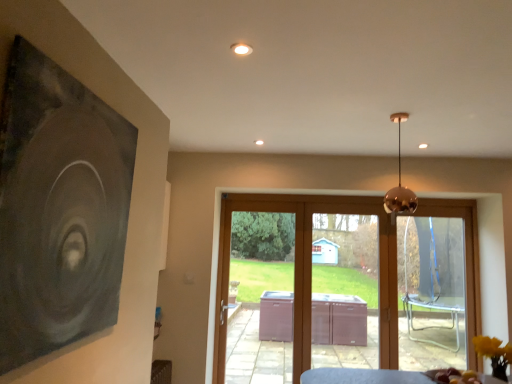
This screenshot has height=384, width=512. What are the coordinates of `brown wood screen door at center` in the screenshot? It's located at (345, 290).

What do you see at coordinates (400, 184) in the screenshot? I see `copper reflective pendant light at upper center` at bounding box center [400, 184].

Find the location of a particular element. The image size is (512, 384). brown wood screen door at center is located at coordinates (345, 290).

Looking at this image, measure the distance between brown wooden door at center and brown wood screen door at center.

brown wooden door at center is 1.36 inches away from brown wood screen door at center.

Considering the sizes of brown wooden door at center and brown wood screen door at center in the image, is brown wooden door at center wider or thinner than brown wood screen door at center?

brown wooden door at center is wider than brown wood screen door at center.

From the image's perspective, is brown wooden door at center positioned above or below brown wood screen door at center?

Clearly, from the image's perspective, brown wooden door at center is below brown wood screen door at center.

From the picture: From a real-world perspective, is brown wooden door at center positioned over brown wood screen door at center based on gravity?

No.

Locate an element on the screen. This screenshot has width=512, height=384. lamp on the right of dark matte painting at left is located at coordinates (400, 184).

From the picture: Is dark matte painting at left located outside copper reflective pendant light at upper center?

Absolutely, dark matte painting at left is external to copper reflective pendant light at upper center.

Is dark matte painting at left oriented towards copper reflective pendant light at upper center?

Yes, dark matte painting at left is oriented towards copper reflective pendant light at upper center.

Is brown wood screen door at center far from copper reflective pendant light at upper center?

brown wood screen door at center is positioned a significant distance from copper reflective pendant light at upper center.

How far apart are brown wood screen door at center and copper reflective pendant light at upper center?

7.27 feet.

Choose the correct answer: Is brown wood screen door at center inside copper reflective pendant light at upper center or outside it?

brown wood screen door at center exists outside the volume of copper reflective pendant light at upper center.

Does point (111, 117) lie behind point (305, 333)?

That is False.

From a real-world perspective, does dark matte painting at left stand above brown wooden door at center?

Correct, in the physical world, dark matte painting at left is higher than brown wooden door at center.

Is dark matte painting at left situated inside brown wooden door at center or outside?

dark matte painting at left is outside brown wooden door at center.

Is dark matte painting at left facing towards brown wooden door at center?

No, dark matte painting at left is not aimed at brown wooden door at center.

Does dark matte painting at left have a greater width compared to brown wood screen door at center?

Incorrect, the width of dark matte painting at left does not surpass that of brown wood screen door at center.

In terms of size, does dark matte painting at left appear bigger or smaller than brown wood screen door at center?

dark matte painting at left is smaller than brown wood screen door at center.

This screenshot has height=384, width=512. What are the coordinates of `screen door below the dark matte painting at left (from the image's perspective)` in the screenshot? It's located at (345, 290).

From a real-world perspective, is dark matte painting at left located beneath brown wood screen door at center?

No.

Consider the image. Considering the sizes of objects brown wood screen door at center and dark matte painting at left in the image provided, who is taller, brown wood screen door at center or dark matte painting at left?

With more height is brown wood screen door at center.

Does brown wood screen door at center turn towards dark matte painting at left?

No, brown wood screen door at center is not turned towards dark matte painting at left.

Is brown wood screen door at center next to dark matte painting at left?

No, brown wood screen door at center is not touching dark matte painting at left.

The image size is (512, 384). Find the location of `screen door located underneath the dark matte painting at left (from a real-world perspective)`. screen door located underneath the dark matte painting at left (from a real-world perspective) is located at coordinates (345, 290).

Considering the sizes of objects copper reflective pendant light at upper center and dark matte painting at left in the image provided, who is taller, copper reflective pendant light at upper center or dark matte painting at left?

With more height is dark matte painting at left.

Considering the relative sizes of copper reflective pendant light at upper center and dark matte painting at left in the image provided, is copper reflective pendant light at upper center wider than dark matte painting at left?

Yes.

Is copper reflective pendant light at upper center aimed at dark matte painting at left?

No, copper reflective pendant light at upper center does not turn towards dark matte painting at left.

Is point (386, 195) positioned after point (112, 235)?

Yes.

Where is `screen door located above the brown wooden door at center (from the image's perspective)`? This screenshot has width=512, height=384. screen door located above the brown wooden door at center (from the image's perspective) is located at coordinates (345, 290).

This screenshot has width=512, height=384. I want to click on picture frame in front of the copper reflective pendant light at upper center, so click(x=59, y=208).

Which object lies further to the anchor point brown wood screen door at center, dark matte painting at left or brown wooden door at center?

The object further to brown wood screen door at center is dark matte painting at left.

Looking at the image, which one is located closer to brown wood screen door at center, dark matte painting at left or copper reflective pendant light at upper center?

copper reflective pendant light at upper center lies closer to brown wood screen door at center than the other object.

Looking at the image, which one is located closer to dark matte painting at left, brown wood screen door at center or brown wooden door at center?

brown wooden door at center lies closer to dark matte painting at left than the other object.

Considering their positions, is brown wood screen door at center positioned further to copper reflective pendant light at upper center than dark matte painting at left?

dark matte painting at left is positioned further to the anchor copper reflective pendant light at upper center.

Which object lies further to the anchor point copper reflective pendant light at upper center, brown wood screen door at center or brown wooden door at center?

brown wood screen door at center is further to copper reflective pendant light at upper center.

From the image, which object appears to be farther from brown wood screen door at center, brown wooden door at center or copper reflective pendant light at upper center?

Based on the image, copper reflective pendant light at upper center appears to be further to brown wood screen door at center.

From the image, which object appears to be farther from brown wooden door at center, copper reflective pendant light at upper center or dark matte painting at left?

dark matte painting at left is further to brown wooden door at center.

Based on their spatial positions, is dark matte painting at left or brown wooden door at center closer to copper reflective pendant light at upper center?

Based on the image, brown wooden door at center appears to be nearer to copper reflective pendant light at upper center.

You are a GUI agent. You are given a task and a screenshot of the screen. Output one action in this format:
    pyautogui.click(x=<x>, y=<y>)
    Task: Click on the lamp located between dark matte painting at left and brown wooden door at center in the depth direction
    The height and width of the screenshot is (384, 512).
    Given the screenshot: What is the action you would take?
    pyautogui.click(x=400, y=184)

Identify the location of door positioned between copper reflective pendant light at upper center and brown wood screen door at center from near to far. (343, 286).

Identify the location of door between dark matte painting at left and brown wood screen door at center from front to back. The width and height of the screenshot is (512, 384). (343, 286).

The height and width of the screenshot is (384, 512). Identify the location of lamp between dark matte painting at left and brown wood screen door at center from front to back. (400, 184).